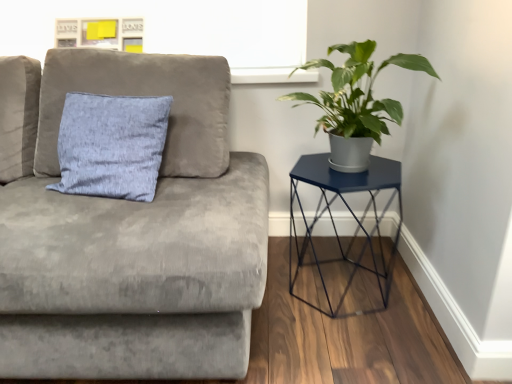
Where is `metallic blue hexagonal table at right`? metallic blue hexagonal table at right is located at coordinates (349, 211).

From the image's perspective, between metallic blue hexagonal table at right and velvet gray couch at upper left, who is located below?

metallic blue hexagonal table at right appears lower in the image.

Based on the photo, considering the relative sizes of metallic blue hexagonal table at right and velvet gray couch at upper left in the image provided, is metallic blue hexagonal table at right wider than velvet gray couch at upper left?

No.

From a real-world perspective, is metallic blue hexagonal table at right under velvet gray couch at upper left?

Yes, from a real-world perspective, metallic blue hexagonal table at right is under velvet gray couch at upper left.

Considering the relative positions of metallic blue hexagonal table at right and velvet gray couch at upper left in the image provided, is metallic blue hexagonal table at right to the left of velvet gray couch at upper left from the viewer's perspective?

In fact, metallic blue hexagonal table at right is to the right of velvet gray couch at upper left.

Locate an element on the screen. The height and width of the screenshot is (384, 512). houseplant located in front of the metallic blue hexagonal table at right is located at coordinates (356, 103).

From the picture: From the image's perspective, would you say green matte plant at right is shown under metallic blue hexagonal table at right?

No.

Considering the sizes of objects green matte plant at right and metallic blue hexagonal table at right in the image provided, who is bigger, green matte plant at right or metallic blue hexagonal table at right?

Bigger between the two is metallic blue hexagonal table at right.

Considering the relative sizes of green matte plant at right and metallic blue hexagonal table at right in the image provided, is green matte plant at right shorter than metallic blue hexagonal table at right?

Yes, green matte plant at right is shorter than metallic blue hexagonal table at right.

Looking at this image, could green matte plant at right be considered to be inside velvet gray couch at upper left?

No, green matte plant at right is not inside velvet gray couch at upper left.

Can you confirm if velvet gray couch at upper left is thinner than green matte plant at right?

In fact, velvet gray couch at upper left might be wider than green matte plant at right.

Consider the image. Is velvet gray couch at upper left bigger or smaller than green matte plant at right?

Clearly, velvet gray couch at upper left is larger in size than green matte plant at right.

Does point (22, 302) appear closer or farther from the camera than point (369, 119)?

Point (22, 302).

Which of these two, metallic blue hexagonal table at right or green matte plant at right, stands taller?

metallic blue hexagonal table at right is taller.

Considering the positions of objects metallic blue hexagonal table at right and green matte plant at right in the image provided, who is more to the right, metallic blue hexagonal table at right or green matte plant at right?

metallic blue hexagonal table at right is more to the right.

Is metallic blue hexagonal table at right not within green matte plant at right?

metallic blue hexagonal table at right is positioned outside green matte plant at right.

Is green matte plant at right oriented away from velvet gray couch at upper left?

green matte plant at right does not have its back to velvet gray couch at upper left.

Is velvet gray couch at upper left surrounded by green matte plant at right?

Definitely not — velvet gray couch at upper left is not inside green matte plant at right.

Is green matte plant at right wider than velvet gray couch at upper left?

No, green matte plant at right is not wider than velvet gray couch at upper left.

Identify the location of studio couch located above the metallic blue hexagonal table at right (from a real-world perspective). This screenshot has width=512, height=384. (135, 238).

Is velvet gray couch at upper left directly adjacent to metallic blue hexagonal table at right?

There is a gap between velvet gray couch at upper left and metallic blue hexagonal table at right.

Is the position of velvet gray couch at upper left less distant than that of metallic blue hexagonal table at right?

Yes, velvet gray couch at upper left is in front of metallic blue hexagonal table at right.

Is velvet gray couch at upper left shorter than metallic blue hexagonal table at right?

No, velvet gray couch at upper left is not shorter than metallic blue hexagonal table at right.

This screenshot has height=384, width=512. I want to click on studio couch above the metallic blue hexagonal table at right (from the image's perspective), so click(x=135, y=238).

Locate an element on the screen. This screenshot has height=384, width=512. table directly beneath the green matte plant at right (from a real-world perspective) is located at coordinates (349, 211).

Which object lies nearer to the anchor point velvet gray couch at upper left, green matte plant at right or metallic blue hexagonal table at right?

Among the two, metallic blue hexagonal table at right is located nearer to velvet gray couch at upper left.

Estimate the real-world distances between objects in this image. Which object is further from metallic blue hexagonal table at right, velvet gray couch at upper left or green matte plant at right?

velvet gray couch at upper left is positioned further to the anchor metallic blue hexagonal table at right.

Based on their spatial positions, is velvet gray couch at upper left or metallic blue hexagonal table at right closer to green matte plant at right?

metallic blue hexagonal table at right is positioned closer to the anchor green matte plant at right.

Estimate the real-world distances between objects in this image. Which object is further from metallic blue hexagonal table at right, green matte plant at right or velvet gray couch at upper left?

The object further to metallic blue hexagonal table at right is velvet gray couch at upper left.

When comparing their distances from velvet gray couch at upper left, does metallic blue hexagonal table at right or green matte plant at right seem further?

Based on the image, green matte plant at right appears to be further to velvet gray couch at upper left.

When comparing their distances from green matte plant at right, does metallic blue hexagonal table at right or velvet gray couch at upper left seem further?

velvet gray couch at upper left lies further to green matte plant at right than the other object.

Where is `houseplant between velvet gray couch at upper left and metallic blue hexagonal table at right from left to right`? houseplant between velvet gray couch at upper left and metallic blue hexagonal table at right from left to right is located at coordinates (356, 103).